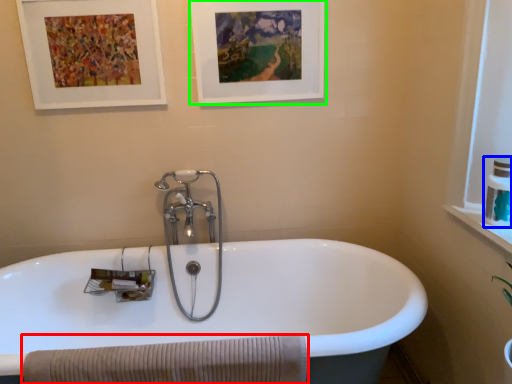
Question: Which is nearer to the bath towel (highlighted by a red box)? toiletry (highlighted by a blue box) or picture frame (highlighted by a green box).

Choices:
 (A) toiletry
 (B) picture frame

Answer: (A)